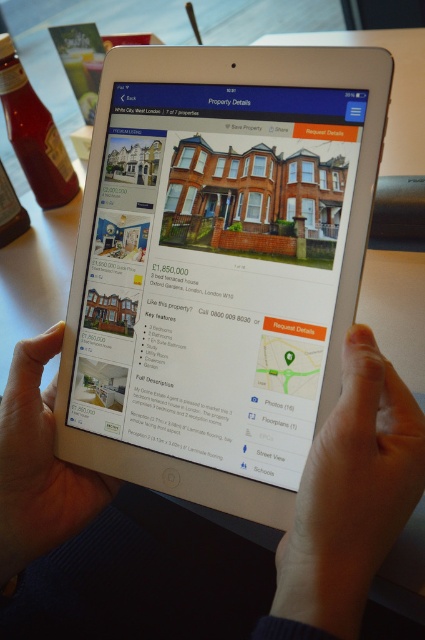
Looking at this image, you are a real estate agent looking at the tablet screen. You notice the white matte skin at center and the skinny white hand at lower center. Which object is located to the right of the other?

The white matte skin at center is positioned on the right side of skinny white hand at lower center.

You are a real estate agent who wants to show a client the tablet screen. The client is standing 1 meter away from the white plastic tablet at center. Can they read the text on the tablet screen without moving closer?

The client is standing 1 meter away from the white plastic tablet at center. The tablet screen and the client are 38.29 centimeters apart, so the client is close enough to read the text on the tablet screen without needing to move closer.